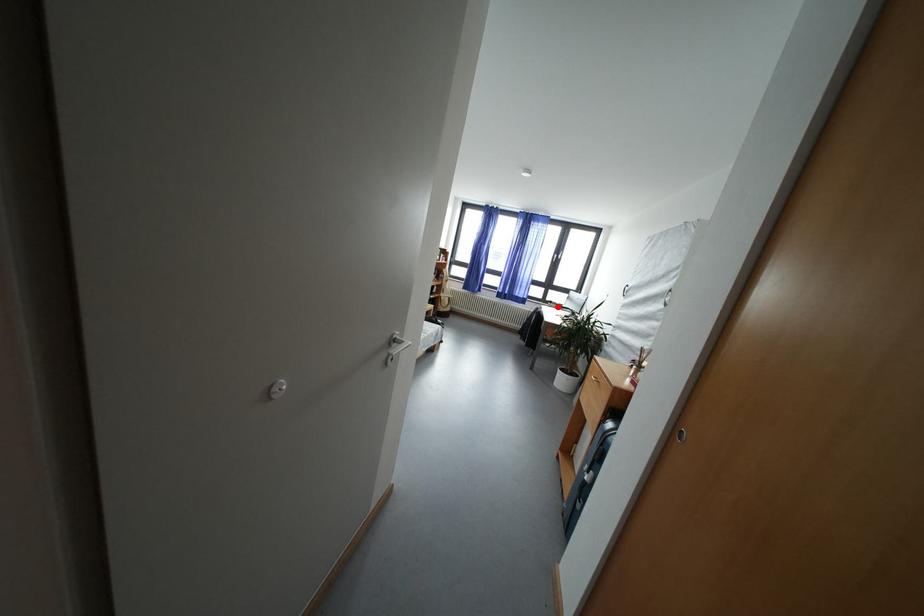
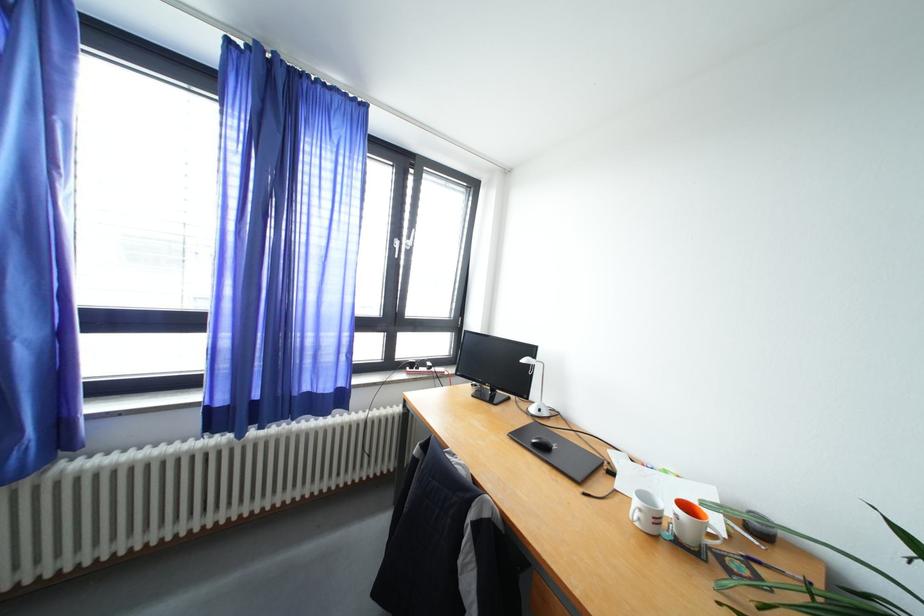
Locate, in the second image, the point that corresponds to the highlighted location in the first image.

(419, 370)